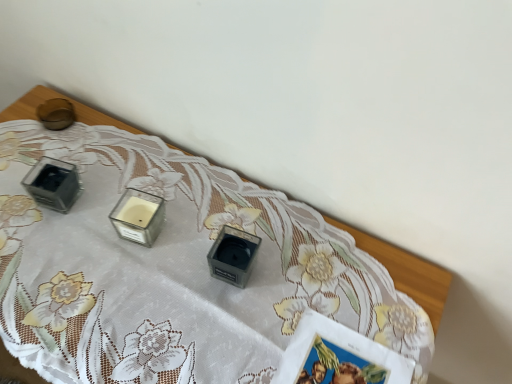
Question: From their relative heights in the image, would you say matte glass candle at upper left is taller or shorter than clear glass candle at center?

Choices:
 (A) tall
 (B) short

Answer: (A)

Question: From a real-world perspective, is matte glass candle at upper left above or below clear glass candle at center?

Choices:
 (A) below
 (B) above

Answer: (A)

Question: From the image's perspective, is matte glass candle at upper left above or below clear glass candle at center?

Choices:
 (A) below
 (B) above

Answer: (A)

Question: From their relative heights in the image, would you say clear glass candle at center is taller or shorter than matte glass candle at upper left?

Choices:
 (A) short
 (B) tall

Answer: (A)

Question: Considering the positions of clear glass candle at center and matte glass candle at upper left in the image, is clear glass candle at center wider or thinner than matte glass candle at upper left?

Choices:
 (A) thin
 (B) wide

Answer: (A)

Question: Visually, is clear glass candle at center positioned to the left or to the right of matte glass candle at upper left?

Choices:
 (A) right
 (B) left

Answer: (B)

Question: Considering the positions of point (158, 228) and point (451, 278), is point (158, 228) closer or farther from the camera than point (451, 278)?

Choices:
 (A) farther
 (B) closer

Answer: (A)